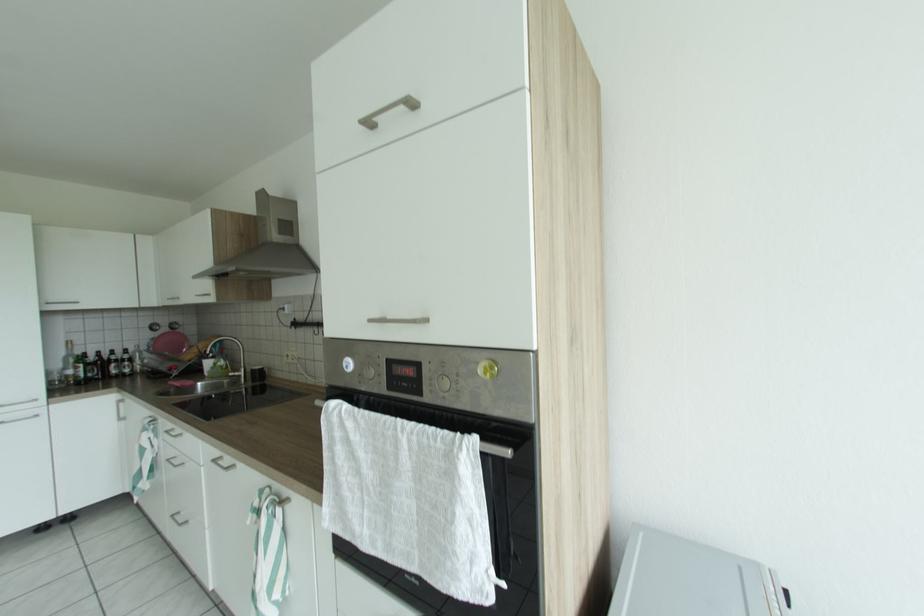
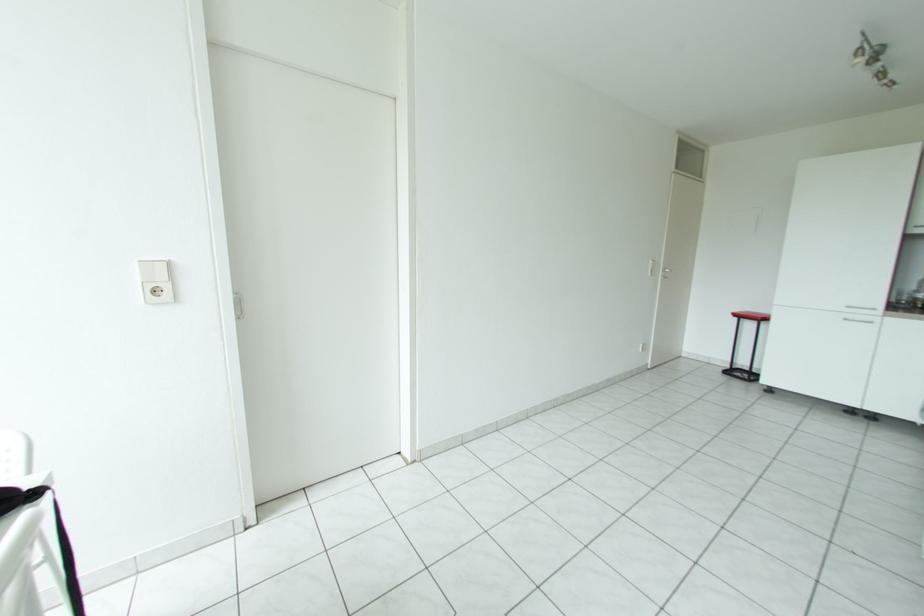
Question: The images are taken continuously from a first-person perspective. In which direction is your viewpoint rotating?

Choices:
 (A) Left
 (B) Right
 (C) Up
 (D) Down

Answer: (A)